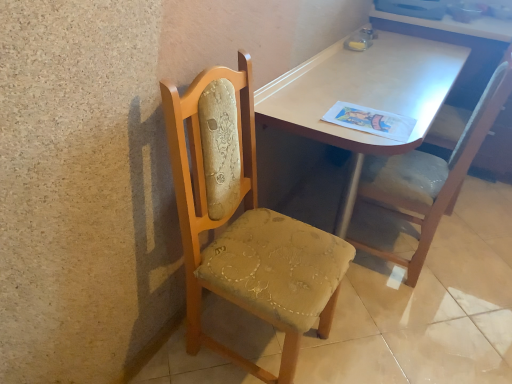
Question: Considering the positions of velvet upholstered chair at right, the second chair when ordered from left to right, and light brown wood table at center in the image, is velvet upholstered chair at right, the second chair when ordered from left to right, wider or thinner than light brown wood table at center?

Choices:
 (A) thin
 (B) wide

Answer: (A)

Question: From the image's perspective, relative to light brown wood table at center, is velvet upholstered chair at right, the first chair viewed from the right, above or below?

Choices:
 (A) above
 (B) below

Answer: (B)

Question: Estimate the real-world distances between objects in this image. Which object is farther from the woodenchair at left, the 1th chair viewed from the left?

Choices:
 (A) light brown wood table at center
 (B) wooden chair at left
 (C) velvet upholstered chair at right, the first chair viewed from the right

Answer: (C)

Question: Which is nearer to the velvet upholstered chair at right, the first chair viewed from the right?

Choices:
 (A) light brown wood table at center
 (B) wooden chair at left
 (C) woodenchair at left, which is the second chair from right to left

Answer: (A)